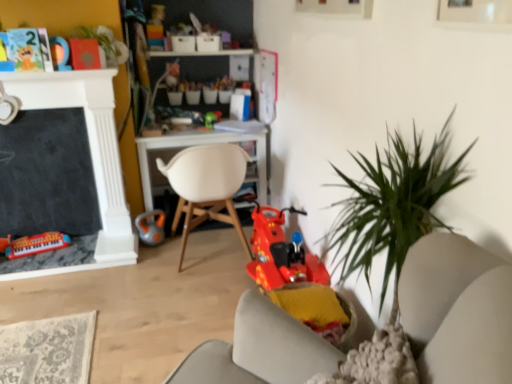
This screenshot has width=512, height=384. What do you see at coordinates (151, 227) in the screenshot?
I see `orange rubber kettlebell at center, acting as the 3th toy starting from the right` at bounding box center [151, 227].

Measure the distance between point (x=175, y=185) and camera.

Point (x=175, y=185) is 2.55 meters from camera.

The height and width of the screenshot is (384, 512). What are the coordinates of `green leafy plant at upper left` in the screenshot? It's located at (103, 43).

Considering the sizes of objects green leafy plant at upper left and shiny plastic scooter at center, which is the 4th toy from top to bottom, in the image provided, who is bigger, green leafy plant at upper left or shiny plastic scooter at center, which is the 4th toy from top to bottom,?

shiny plastic scooter at center, which is the 4th toy from top to bottom, is bigger.

From the image's perspective, who appears lower, green leafy plant at upper left or shiny plastic scooter at center, the 1th toy when ordered from right to left?

shiny plastic scooter at center, the 1th toy when ordered from right to left.

Is green leafy plant at upper left looking in the opposite direction of shiny plastic scooter at center, the second toy when ordered from bottom to top?

No, green leafy plant at upper left is not facing the opposite direction of shiny plastic scooter at center, the second toy when ordered from bottom to top.

Does green leafy plant at upper left touch shiny plastic scooter at center, the second toy when ordered from bottom to top?

No, green leafy plant at upper left is not with shiny plastic scooter at center, the second toy when ordered from bottom to top.

From the image's perspective, count 4th toys downward from the matte plastic toy at upper left, positioned as the 5th toy in bottom-to-top order, and point to it. Please provide its 2D coordinates.

[(36, 244)]

Consider the image. From a real-world perspective, is matte plastic toy at upper left, which ranks as the 1th toy in top-to-bottom order, under matte plastic keyboard at lower left, the first toy positioned from the bottom?

No, from a real-world perspective, matte plastic toy at upper left, which ranks as the 1th toy in top-to-bottom order, is not beneath matte plastic keyboard at lower left, the first toy positioned from the bottom.

Does matte plastic toy at upper left, which ranks as the 1th toy in top-to-bottom order, have a larger size compared to matte plastic keyboard at lower left, the fifth toy positioned from the top?

Actually, matte plastic toy at upper left, which ranks as the 1th toy in top-to-bottom order, might be smaller than matte plastic keyboard at lower left, the fifth toy positioned from the top.

Based on the photo, which of these two, matte plastic toy at upper left, the 2th toy from the left, or matte plastic keyboard at lower left, arranged as the first toy when viewed from the left, stands shorter?

With less height is matte plastic keyboard at lower left, arranged as the first toy when viewed from the left.

Do you think orange rubber kettlebell at center, placed as the third toy when sorted from left to right, is within white matte chair at center, or outside of it?

orange rubber kettlebell at center, placed as the third toy when sorted from left to right, is located beyond the bounds of white matte chair at center.

Find the location of a particular element. The image size is (512, 384). chair above the orange rubber kettlebell at center, the 3th toy viewed from the top (from a real-world perspective) is located at coordinates (206, 186).

From the image's perspective, is orange rubber kettlebell at center, acting as the 3th toy starting from the right, located above or below white matte chair at center?

Based on their image positions, orange rubber kettlebell at center, acting as the 3th toy starting from the right, is located beneath white matte chair at center.

Between green leafy plant at upper left and green plastic toy at center, the 4th toy when ordered from bottom to top, which one has smaller width?

Thinner between the two is green plastic toy at center, the 4th toy when ordered from bottom to top.

Is green plastic toy at center, the 2th toy in the top-to-bottom sequence, at the back of green leafy plant at upper left?

green leafy plant at upper left is not turned away from green plastic toy at center, the 2th toy in the top-to-bottom sequence.

Is point (100, 45) less distant than point (209, 123)?

That is True.

Is green leafy plant at upper left far from green plastic toy at center, placed as the 4th toy when sorted from left to right?

No, green leafy plant at upper left is not far from green plastic toy at center, placed as the 4th toy when sorted from left to right.

Choose the correct answer: Is green plastic toy at center, the 2th toy in the top-to-bottom sequence, inside green leafy plant at upper left or outside it?

green plastic toy at center, the 2th toy in the top-to-bottom sequence, is outside green leafy plant at upper left.

Looking at this image, from a real-world perspective, does green plastic toy at center, placed as the 4th toy when sorted from left to right, sit lower than green leafy plant at upper left?

Yes, from a real-world perspective, green plastic toy at center, placed as the 4th toy when sorted from left to right, is below green leafy plant at upper left.

Consider the image. Considering the sizes of objects green plastic toy at center, the 2th toy in the top-to-bottom sequence, and green leafy plant at upper left in the image provided, who is taller, green plastic toy at center, the 2th toy in the top-to-bottom sequence, or green leafy plant at upper left?

With more height is green leafy plant at upper left.

Which of these two, matte plastic toy at upper left, which is the fourth toy in right-to-left order, or green plastic toy at center, the 4th toy when ordered from bottom to top, is wider?

green plastic toy at center, the 4th toy when ordered from bottom to top, is wider.

Which is correct: matte plastic toy at upper left, which ranks as the 1th toy in top-to-bottom order, is inside green plastic toy at center, the 4th toy when ordered from bottom to top, or outside of it?

matte plastic toy at upper left, which ranks as the 1th toy in top-to-bottom order, cannot be found inside green plastic toy at center, the 4th toy when ordered from bottom to top.

Locate an element on the screen. The height and width of the screenshot is (384, 512). toy that is the 3rd object located in front of the green plastic toy at center, the 4th toy when ordered from bottom to top is located at coordinates (60, 53).

Considering the sizes of objects shiny plastic scooter at center, the second toy when ordered from bottom to top, and white matte chair at center in the image provided, who is taller, shiny plastic scooter at center, the second toy when ordered from bottom to top, or white matte chair at center?

white matte chair at center is taller.

Measure the distance from shiny plastic scooter at center, the 1th toy when ordered from right to left, to white matte chair at center.

A distance of 20.00 inches exists between shiny plastic scooter at center, the 1th toy when ordered from right to left, and white matte chair at center.

There is a white matte chair at center. Where is `the 1st toy below it (from a real-world perspective)`? The image size is (512, 384). the 1st toy below it (from a real-world perspective) is located at coordinates (281, 252).

Is shiny plastic scooter at center, which is the 4th toy from top to bottom, turned away from white matte chair at center?

shiny plastic scooter at center, which is the 4th toy from top to bottom, does not have its back to white matte chair at center.

Find the location of `the 3rd toy counting from the right side of the green leafy plant at upper left`. the 3rd toy counting from the right side of the green leafy plant at upper left is located at coordinates (281, 252).

Where is `the 4th toy above the matte plastic keyboard at lower left, the fifth toy viewed from the right (from the image's perspective)`? This screenshot has width=512, height=384. the 4th toy above the matte plastic keyboard at lower left, the fifth toy viewed from the right (from the image's perspective) is located at coordinates (60, 53).

Based on their spatial positions, is white matte chair at center or green leafy plant at upper left further from shiny plastic scooter at center, the 1th toy when ordered from right to left?

Based on the image, green leafy plant at upper left appears to be further to shiny plastic scooter at center, the 1th toy when ordered from right to left.

Considering their positions, is green plastic toy at center, placed as the 4th toy when sorted from left to right, positioned closer to matte plastic keyboard at lower left, arranged as the first toy when viewed from the left, than orange rubber kettlebell at center, the 3th toy viewed from the top?

Based on the image, orange rubber kettlebell at center, the 3th toy viewed from the top, appears to be nearer to matte plastic keyboard at lower left, arranged as the first toy when viewed from the left.

Estimate the real-world distances between objects in this image. Which object is closer to green leafy plant at upper left, matte plastic toy at upper left, which ranks as the 1th toy in top-to-bottom order, or orange rubber kettlebell at center, acting as the 3th toy starting from the right?

matte plastic toy at upper left, which ranks as the 1th toy in top-to-bottom order.

Looking at the image, which one is located closer to matte plastic keyboard at lower left, arranged as the first toy when viewed from the left, shiny plastic scooter at center, the 1th toy when ordered from right to left, or green leafy plant at upper left?

green leafy plant at upper left is closer to matte plastic keyboard at lower left, arranged as the first toy when viewed from the left.

Based on their spatial positions, is matte plastic toy at upper left, the 2th toy from the left, or matte plastic keyboard at lower left, the fifth toy positioned from the top, closer to green leafy plant at upper left?

matte plastic toy at upper left, the 2th toy from the left, lies closer to green leafy plant at upper left than the other object.

Estimate the real-world distances between objects in this image. Which object is closer to matte plastic toy at upper left, positioned as the 5th toy in bottom-to-top order, matte plastic keyboard at lower left, arranged as the first toy when viewed from the left, or shiny plastic scooter at center, the second toy when ordered from bottom to top?

The object closer to matte plastic toy at upper left, positioned as the 5th toy in bottom-to-top order, is matte plastic keyboard at lower left, arranged as the first toy when viewed from the left.

When comparing their distances from white matte chair at center, does matte plastic toy at upper left, the 2th toy from the left, or matte plastic keyboard at lower left, the fifth toy viewed from the right, seem closer?

matte plastic keyboard at lower left, the fifth toy viewed from the right.

Considering their positions, is green leafy plant at upper left positioned closer to matte plastic keyboard at lower left, the first toy positioned from the bottom, than green plastic toy at center, placed as the 4th toy when sorted from left to right?

Among the two, green leafy plant at upper left is located nearer to matte plastic keyboard at lower left, the first toy positioned from the bottom.

Find the location of a particular element. This screenshot has width=512, height=384. chair between matte plastic toy at upper left, which is the fourth toy in right-to-left order, and shiny plastic scooter at center, which is the 4th toy from top to bottom, from left to right is located at coordinates (206, 186).

Find the location of a particular element. The image size is (512, 384). chair between matte plastic toy at upper left, positioned as the 5th toy in bottom-to-top order, and matte plastic keyboard at lower left, the first toy positioned from the bottom, in the vertical direction is located at coordinates (x=206, y=186).

At what (x,y) coordinates should I click in order to perform the action: click on chair between matte plastic keyboard at lower left, the first toy positioned from the bottom, and shiny plastic scooter at center, the second toy when ordered from bottom to top, in the horizontal direction. Please return your answer as a coordinate pair (x, y). This screenshot has width=512, height=384. Looking at the image, I should click on (206, 186).

Locate an element on the screen. The height and width of the screenshot is (384, 512). chair between matte plastic toy at upper left, positioned as the 5th toy in bottom-to-top order, and orange rubber kettlebell at center, acting as the 3th toy starting from the right, from top to bottom is located at coordinates (206, 186).